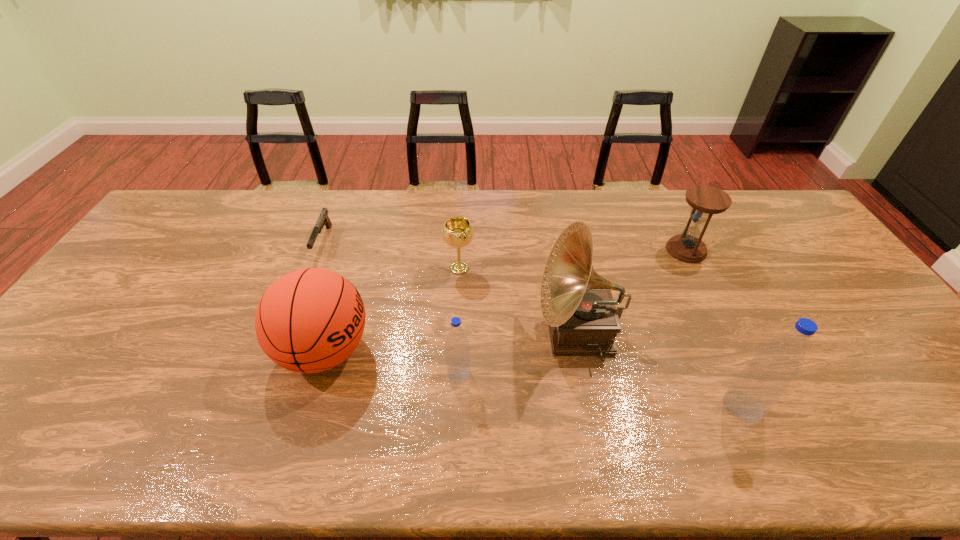
What are the coordinates of `free location located 0.060m on the right of the nearer water bottle` in the screenshot? It's located at (787, 406).

At what (x,y) coordinates should I click in order to perform the action: click on vacant area located 0.150m at the muzzle end of the shortest object. Please return your answer as a coordinate pair (x, y). Looking at the image, I should click on (301, 299).

Where is `vacant space located on the left of the hourglass`? This screenshot has height=540, width=960. vacant space located on the left of the hourglass is located at coordinates (626, 250).

Find the location of a particular element. This screenshot has width=960, height=540. vacant space situated 0.320m on the front of the sixth tallest object is located at coordinates (455, 369).

Locate an element on the screen. The image size is (960, 540). vacant area situated on the horn of the fifth object from left to right is located at coordinates (481, 333).

Locate an element on the screen. vacant region located on the horn of the fifth object from left to right is located at coordinates (399, 333).

At what (x,y) coordinates should I click in order to perform the action: click on vacant area situated 0.300m on the horn of the fifth object from left to right. Please return your answer as a coordinate pair (x, y). Looking at the image, I should click on (425, 333).

Find the location of a particular element. Image resolution: width=960 pixels, height=540 pixels. free spot located 0.240m on the side with logo of the basketball is located at coordinates (466, 350).

This screenshot has width=960, height=540. What are the coordinates of `object that is at the far edge` in the screenshot? It's located at (323, 219).

Identify the location of water bottle present at the near edge. This screenshot has height=540, width=960. (762, 382).